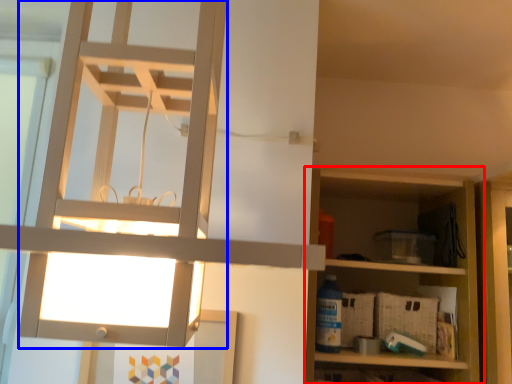
Question: Which point is further to the camera, shelf (highlighted by a red box) or lamp (highlighted by a blue box)?

Choices:
 (A) shelf
 (B) lamp

Answer: (A)